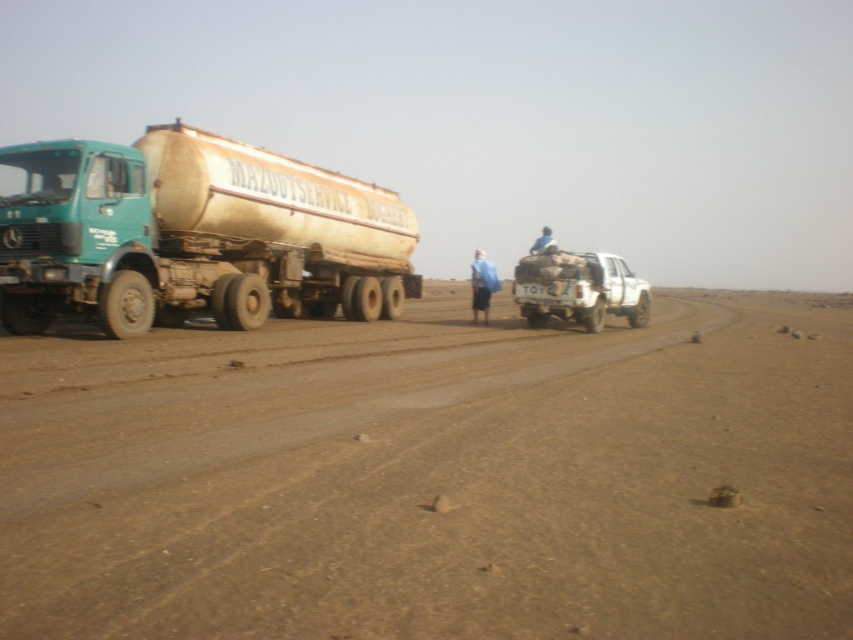
Question: Is white matte truck at center positioned before blue fabric at center?

Choices:
 (A) yes
 (B) no

Answer: (A)

Question: Which point is closer to the camera taking this photo?

Choices:
 (A) (486, 259)
 (B) (276, 182)
 (C) (550, 243)

Answer: (B)

Question: Which of the following is the closest to the observer?

Choices:
 (A) (254, 157)
 (B) (833, 358)

Answer: (B)

Question: Is brown sandy dirt at center smaller than blue fabric bag at center?

Choices:
 (A) yes
 (B) no

Answer: (A)

Question: Estimate the real-world distances between objects in this image. Which object is closer to the rusty metallic tanker at left?

Choices:
 (A) blue fabric bag at center
 (B) blue fabric at center
 (C) white matte truck at center
 (D) brown sandy dirt at center

Answer: (D)

Question: Can you confirm if rusty metallic tanker at left is positioned to the left of white matte truck at center?

Choices:
 (A) yes
 (B) no

Answer: (A)